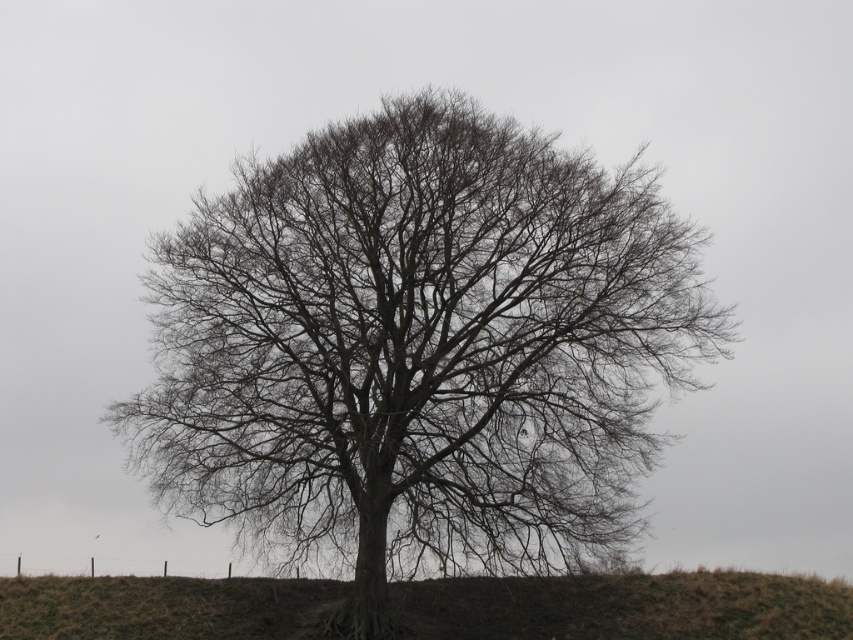
Does bare branches at center have a larger size compared to brown grassy hillside at center?

Correct, bare branches at center is larger in size than brown grassy hillside at center.

Can you confirm if bare branches at center is shorter than brown grassy hillside at center?

In fact, bare branches at center may be taller than brown grassy hillside at center.

Find the location of a particular element. The image size is (853, 640). bare branches at center is located at coordinates (418, 349).